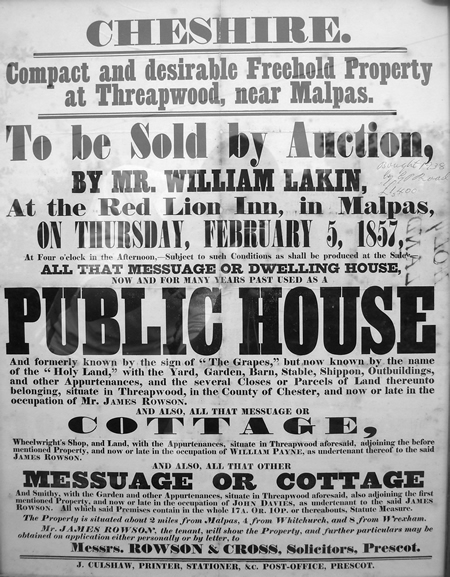
You are a GUI agent. You are given a task and a screenshot of the screen. Output one action in this format:
    pyautogui.click(x=<x>, y=<y>)
    Task: Click on the newspaper
    Image resolution: width=450 pixels, height=577 pixels.
    Given the screenshot: What is the action you would take?
    pyautogui.click(x=62, y=29)